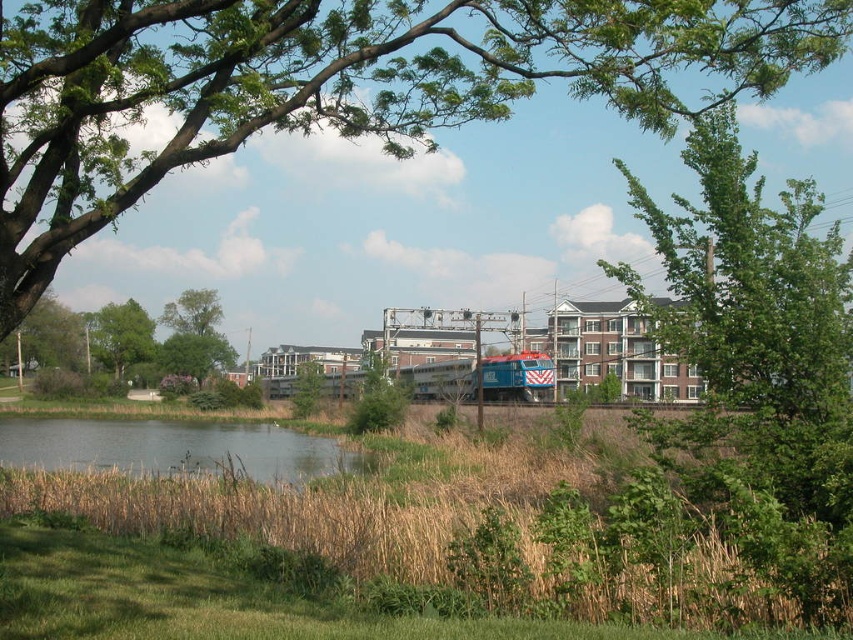
You are standing in the suburban area and want to cross the green grassy river at lower left to reach the green leafy tree at left. Is the tree to the left or right of the river?

The green leafy tree at left is to the left of the green grassy river at lower left, so the tree is on the left side of the river.

You are a landscape architect designing a new park. You need to place a bench near the green grassy river at lower left and the green leafy tree at left. Considering their sizes, which object should the bench be placed closer to for better visibility?

The bench should be placed closer to the green leafy tree at left because it is larger in size than the green grassy river at lower left, making it more prominent and suitable for visibility.

Looking at this image, you are standing at the camera position and want to take a photo of the green leafy tree at upper center. If your camera can focus on objects up to 10 meters away, will it be able to capture the tree clearly?

The green leafy tree at upper center is 8.49 meters away from the camera, which is within the camera focus range of up to 10 meters. Therefore, the camera can capture the tree clearly.